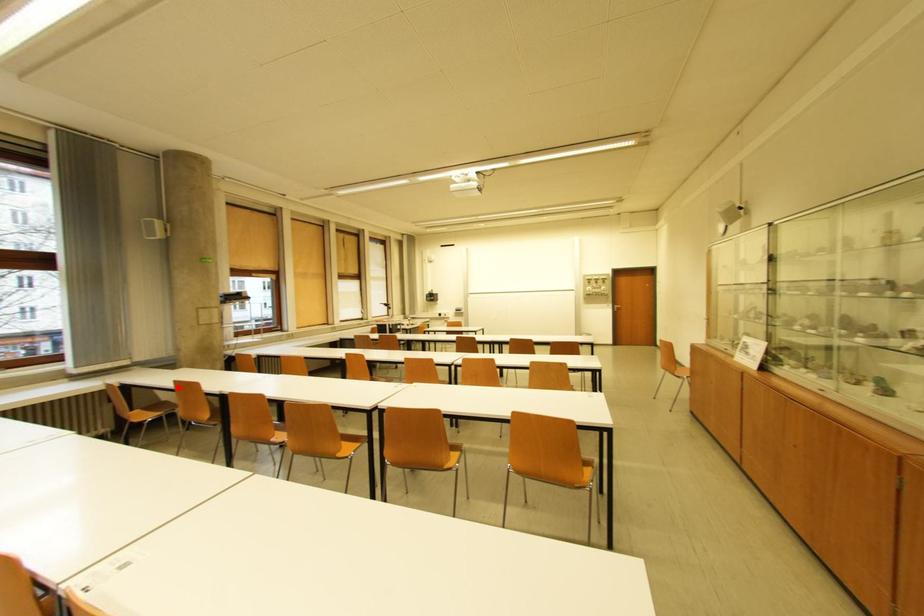
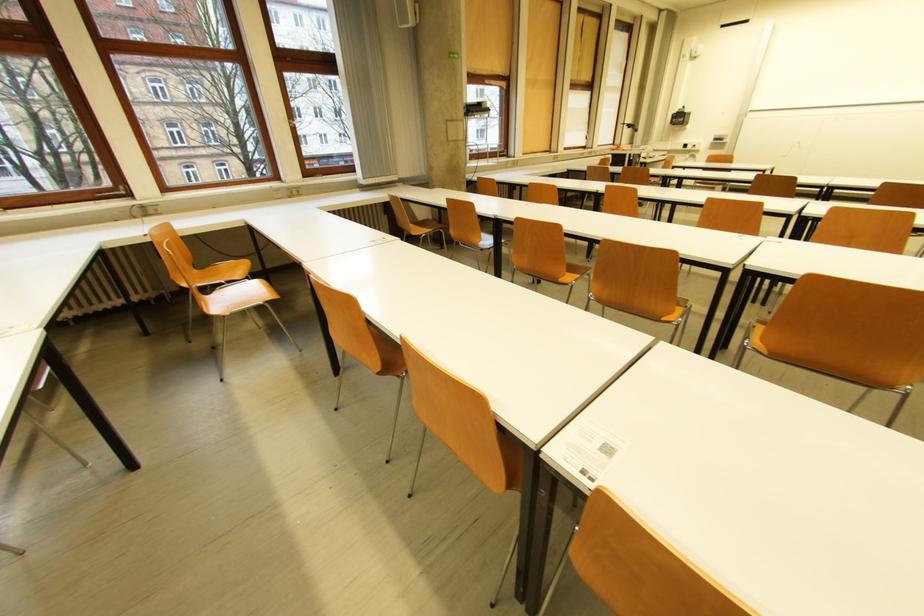
Question: I am providing you with two images of the same scene from different viewpoints. In image1, a red point is highlighted. Considering the same 3D point in image2, which of the following is correct?

Choices:
 (A) It is closer
 (B) It is farther

Answer: (A)